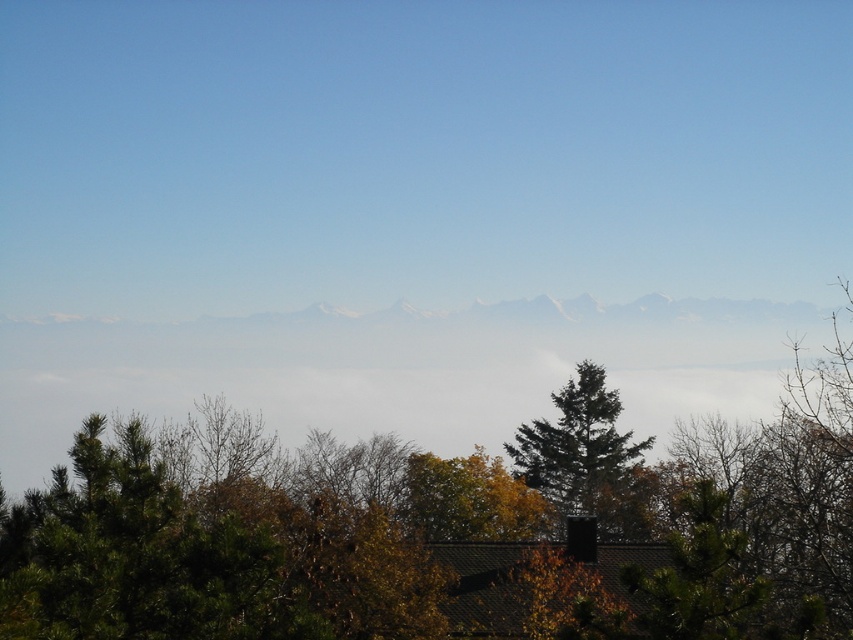
Between green textured tree at center and green needle-like tree at center, which one has more height?

Standing taller between the two is green textured tree at center.

Consider the image. Who is positioned more to the right, green textured tree at center or green needle-like tree at center?

From the viewer's perspective, green needle-like tree at center appears more on the right side.

The width and height of the screenshot is (853, 640). I want to click on green textured tree at center, so click(444, 525).

Image resolution: width=853 pixels, height=640 pixels. Identify the location of green textured tree at center. (444, 525).

Between green needle-like tree at center and yellow-green foliage at center, which one has more height?

green needle-like tree at center

Is green needle-like tree at center wider than yellow-green foliage at center?

Yes, green needle-like tree at center is wider than yellow-green foliage at center.

Is point (585, 396) positioned in front of point (415, 460)?

No, it is not.

This screenshot has height=640, width=853. I want to click on green needle-like tree at center, so click(587, 458).

Can you confirm if green textured tree at center is taller than yellow-green foliage at center?

Yes, green textured tree at center is taller than yellow-green foliage at center.

Is point (227, 628) closer to viewer compared to point (409, 513)?

Yes, point (227, 628) is in front of point (409, 513).

Locate an element on the screen. green textured tree at center is located at coordinates (444, 525).